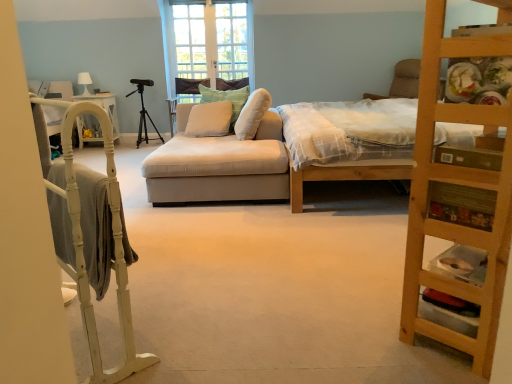
Question: Is white glass door at center shorter than wooden bed at center?

Choices:
 (A) no
 (B) yes

Answer: (A)

Question: From a real-world perspective, is white glass door at center over wooden bed at center?

Choices:
 (A) no
 (B) yes

Answer: (B)

Question: Is white glass door at center at the left side of wooden bed at center?

Choices:
 (A) no
 (B) yes

Answer: (B)

Question: Does white glass door at center have a greater height compared to wooden bed at center?

Choices:
 (A) yes
 (B) no

Answer: (A)

Question: Is white glass door at center touching wooden bed at center?

Choices:
 (A) no
 (B) yes

Answer: (A)

Question: Does point (230, 114) appear closer or farther from the camera than point (145, 142)?

Choices:
 (A) farther
 (B) closer

Answer: (B)

Question: Considering the positions of white soft cushion at center, arranged as the third pillow when viewed from the right, and black matte tripod at center in the image, is white soft cushion at center, arranged as the third pillow when viewed from the right, wider or thinner than black matte tripod at center?

Choices:
 (A) wide
 (B) thin

Answer: (A)

Question: Is white soft cushion at center, the first pillow viewed from the left, in front of or behind black matte tripod at center in the image?

Choices:
 (A) behind
 (B) front

Answer: (B)

Question: In terms of height, does white soft cushion at center, arranged as the third pillow when viewed from the right, look taller or shorter compared to black matte tripod at center?

Choices:
 (A) short
 (B) tall

Answer: (A)

Question: Is white glass door at center in front of or behind beige fabric couch at center in the image?

Choices:
 (A) behind
 (B) front

Answer: (A)

Question: Would you say white glass door at center is inside or outside beige fabric couch at center?

Choices:
 (A) outside
 (B) inside

Answer: (A)

Question: From a real-world perspective, is white glass door at center above or below beige fabric couch at center?

Choices:
 (A) below
 (B) above

Answer: (B)

Question: In terms of size, does white glass door at center appear bigger or smaller than beige fabric couch at center?

Choices:
 (A) small
 (B) big

Answer: (A)

Question: Considering the positions of white painted wood bunk bed at left and green textured pillow at center, placed as the third pillow when sorted from left to right, in the image, is white painted wood bunk bed at left bigger or smaller than green textured pillow at center, placed as the third pillow when sorted from left to right,?

Choices:
 (A) small
 (B) big

Answer: (B)

Question: Considering their positions, is white painted wood bunk bed at left located in front of or behind green textured pillow at center, placed as the first pillow when sorted from right to left?

Choices:
 (A) behind
 (B) front

Answer: (B)